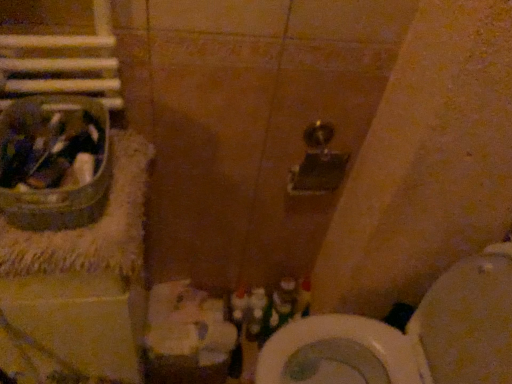
What is the approximate height of metallic silver sink at left?

→ 4.15 inches.

Identify the location of metallic silver sink at left. This screenshot has height=384, width=512. [x=59, y=189].

The image size is (512, 384). What do you see at coordinates (59, 189) in the screenshot? I see `metallic silver sink at left` at bounding box center [59, 189].

What is the approximate width of white glossy toilet at lower right?

It is 26.49 inches.

Identify the location of white glossy toilet at lower right. (409, 336).

Image resolution: width=512 pixels, height=384 pixels. What do you see at coordinates (409, 336) in the screenshot?
I see `white glossy toilet at lower right` at bounding box center [409, 336].

Locate an element on the screen. Image resolution: width=512 pixels, height=384 pixels. metallic silver sink at left is located at coordinates (59, 189).

In the image, is white glossy toilet at lower right on the left side or the right side of metallic silver sink at left?

In the image, white glossy toilet at lower right appears on the right side of metallic silver sink at left.

Is the position of white glossy toilet at lower right less distant than that of metallic silver sink at left?

No, white glossy toilet at lower right is further to the viewer.

Is point (390, 343) closer to camera compared to point (101, 194)?

No, (390, 343) is further to viewer.

In the scene shown: From the image's perspective, which is below, white glossy toilet at lower right or metallic silver sink at left?

white glossy toilet at lower right is shown below in the image.

Looking at this image, from a real-world perspective, which object stands above the other?

metallic silver sink at left.

Is white glossy toilet at lower right thinner than metallic silver sink at left?

Incorrect, the width of white glossy toilet at lower right is not less than that of metallic silver sink at left.

Considering the relative sizes of white glossy toilet at lower right and metallic silver sink at left in the image provided, is white glossy toilet at lower right shorter than metallic silver sink at left?

Incorrect, the height of white glossy toilet at lower right does not fall short of that of metallic silver sink at left.

Can you confirm if white glossy toilet at lower right is bigger than metallic silver sink at left?

Yes, white glossy toilet at lower right is bigger than metallic silver sink at left.

Can metallic silver sink at left be found inside white glossy toilet at lower right?

No, metallic silver sink at left is not a part of white glossy toilet at lower right.

Is white glossy toilet at lower right next to metallic silver sink at left and touching it?

No.

Does white glossy toilet at lower right turn towards metallic silver sink at left?

Yes.

Find the location of a particular element. The height and width of the screenshot is (384, 512). sink in front of the white glossy toilet at lower right is located at coordinates (59, 189).

Is metallic silver sink at left to the left of white glossy toilet at lower right from the viewer's perspective?

Yes.

Considering their positions, is metallic silver sink at left located in front of or behind white glossy toilet at lower right?

metallic silver sink at left is positioned closer to the viewer than white glossy toilet at lower right.

Which is farther from the camera, (75, 96) or (420, 338)?

The point (420, 338) is farther.

From the image's perspective, which one is positioned lower, metallic silver sink at left or white glossy toilet at lower right?

white glossy toilet at lower right is shown below in the image.

From a real-world perspective, is metallic silver sink at left beneath white glossy toilet at lower right?

Incorrect, from a real-world perspective, metallic silver sink at left is higher than white glossy toilet at lower right.

Does metallic silver sink at left have a lesser width compared to white glossy toilet at lower right?

Yes, metallic silver sink at left is thinner than white glossy toilet at lower right.

From their relative heights in the image, would you say metallic silver sink at left is taller or shorter than white glossy toilet at lower right?

metallic silver sink at left is shorter than white glossy toilet at lower right.

Considering the relative sizes of metallic silver sink at left and white glossy toilet at lower right in the image provided, is metallic silver sink at left smaller than white glossy toilet at lower right?

Indeed, metallic silver sink at left has a smaller size compared to white glossy toilet at lower right.

Is metallic silver sink at left outside of white glossy toilet at lower right?

metallic silver sink at left is positioned outside white glossy toilet at lower right.

Are metallic silver sink at left and white glossy toilet at lower right far apart?

Actually, metallic silver sink at left and white glossy toilet at lower right are a little close together.

From the picture: Does metallic silver sink at left turn towards white glossy toilet at lower right?

No.

Can you tell me how much metallic silver sink at left and white glossy toilet at lower right differ in facing direction?

metallic silver sink at left and white glossy toilet at lower right are facing 90.4 degrees away from each other.

How distant is metallic silver sink at left from white glossy toilet at lower right?

metallic silver sink at left and white glossy toilet at lower right are 76.43 centimeters apart.

Where is `toilet behind the metallic silver sink at left`? toilet behind the metallic silver sink at left is located at coordinates (409, 336).

At what (x,y) coordinates should I click in order to perform the action: click on toilet below the metallic silver sink at left (from a real-world perspective). Please return your answer as a coordinate pair (x, y). This screenshot has height=384, width=512. Looking at the image, I should click on (409, 336).

The image size is (512, 384). Find the location of `sink on the left of white glossy toilet at lower right`. sink on the left of white glossy toilet at lower right is located at coordinates (59, 189).